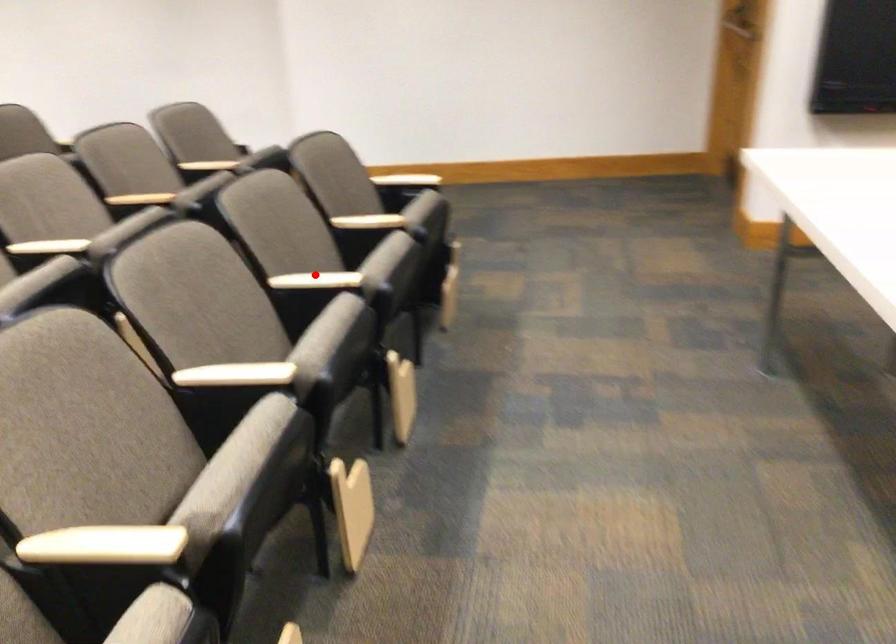
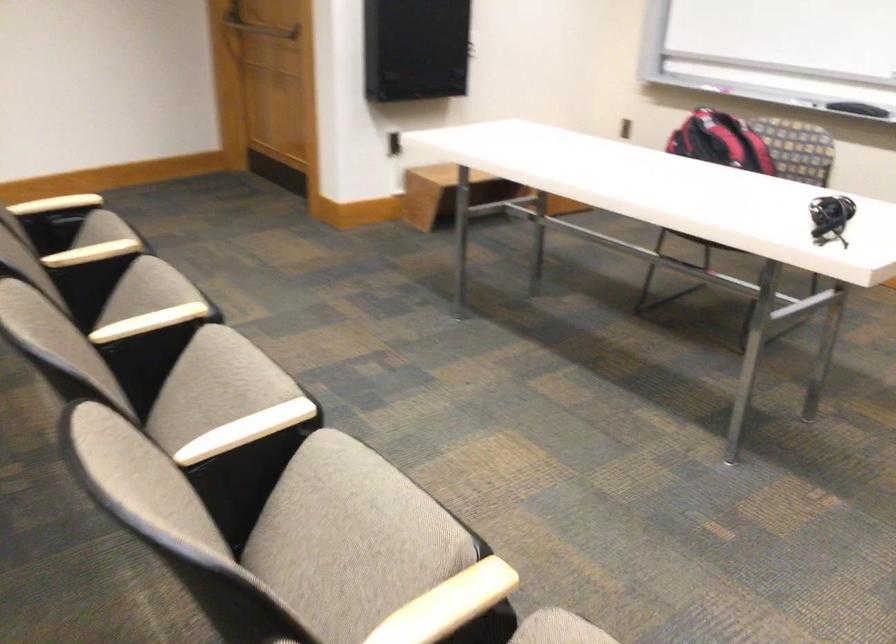
Question: I am providing you with two images of the same scene from different viewpoints. A red point is shown in image1. For the corresponding object point in image2, is it positioned nearer or farther from the camera?

Choices:
 (A) Nearer
 (B) Farther

Answer: (A)